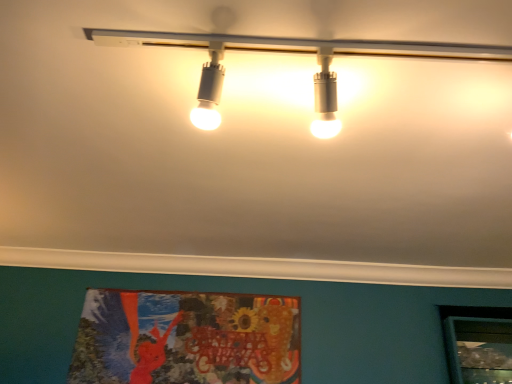
Question: In the image, is white glossy track lights at upper center on the left side or the right side of textured fabric poster at lower center?

Choices:
 (A) left
 (B) right

Answer: (B)

Question: In terms of height, does white glossy track lights at upper center look taller or shorter compared to textured fabric poster at lower center?

Choices:
 (A) short
 (B) tall

Answer: (A)

Question: Is white glossy track lights at upper center situated inside textured fabric poster at lower center or outside?

Choices:
 (A) inside
 (B) outside

Answer: (B)

Question: Is textured fabric poster at lower center wider or thinner than white glossy track lights at upper center?

Choices:
 (A) wide
 (B) thin

Answer: (B)

Question: Do you think textured fabric poster at lower center is within white glossy track lights at upper center, or outside of it?

Choices:
 (A) inside
 (B) outside

Answer: (B)

Question: Considering the positions of point (160, 332) and point (462, 49), is point (160, 332) closer or farther from the camera than point (462, 49)?

Choices:
 (A) farther
 (B) closer

Answer: (A)

Question: From the image's perspective, relative to white glossy track lights at upper center, is textured fabric poster at lower center above or below?

Choices:
 (A) below
 (B) above

Answer: (A)